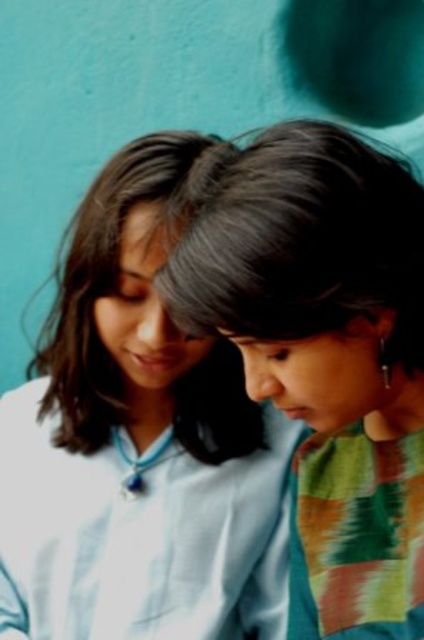
You are standing in front of a wall and see two points marked on it. The first point is at coordinate point (119, 260) and the second is at point (226, 243). Which point is closer to you?

Point (119, 260) is closer to you because it is further to the viewer than point (226, 243).

You are a photographer setting up a portrait session for two people. You notice the white glossy shirt at center and the smooth black hair at center in your frame. Which object should you adjust to ensure proper focus on both subjects?

The white glossy shirt at center is much taller than the smooth black hair at center, so you should adjust the focus to accommodate the height difference between the two objects.